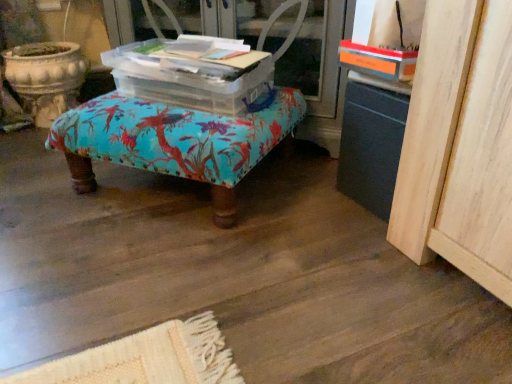
Question: Does transparent plastic screen door at center have a greater width compared to turquoise fabric ottoman at center?

Choices:
 (A) no
 (B) yes

Answer: (A)

Question: From the image's perspective, is transparent plastic screen door at center on turquoise fabric ottoman at center?

Choices:
 (A) yes
 (B) no

Answer: (A)

Question: Does transparent plastic screen door at center turn towards turquoise fabric ottoman at center?

Choices:
 (A) no
 (B) yes

Answer: (B)

Question: From a real-world perspective, is transparent plastic screen door at center physically above turquoise fabric ottoman at center?

Choices:
 (A) yes
 (B) no

Answer: (A)

Question: Is transparent plastic screen door at center not inside turquoise fabric ottoman at center?

Choices:
 (A) yes
 (B) no

Answer: (A)

Question: Is point (78, 134) closer or farther from the camera than point (321, 114)?

Choices:
 (A) farther
 (B) closer

Answer: (B)

Question: Considering the positions of turquoise fabric ottoman at center and transparent plastic screen door at center in the image, is turquoise fabric ottoman at center wider or thinner than transparent plastic screen door at center?

Choices:
 (A) thin
 (B) wide

Answer: (B)

Question: From the image's perspective, is turquoise fabric ottoman at center positioned above or below transparent plastic screen door at center?

Choices:
 (A) above
 (B) below

Answer: (B)

Question: Considering the positions of turquoise fabric ottoman at center and transparent plastic screen door at center in the image, is turquoise fabric ottoman at center bigger or smaller than transparent plastic screen door at center?

Choices:
 (A) small
 (B) big

Answer: (A)

Question: Is point (164, 77) closer or farther from the camera than point (185, 114)?

Choices:
 (A) closer
 (B) farther

Answer: (B)

Question: Looking at the image, does transparent plastic storage box at center seem bigger or smaller compared to turquoise fabric ottoman at center?

Choices:
 (A) big
 (B) small

Answer: (B)

Question: In terms of width, does transparent plastic storage box at center look wider or thinner when compared to turquoise fabric ottoman at center?

Choices:
 (A) thin
 (B) wide

Answer: (A)

Question: From a real-world perspective, is transparent plastic storage box at center physically located above or below turquoise fabric ottoman at center?

Choices:
 (A) above
 (B) below

Answer: (A)

Question: Is turquoise fabric ottoman at center inside or outside of transparent plastic storage box at center?

Choices:
 (A) outside
 (B) inside

Answer: (A)

Question: Is point (261, 109) closer or farther from the camera than point (155, 92)?

Choices:
 (A) farther
 (B) closer

Answer: (B)